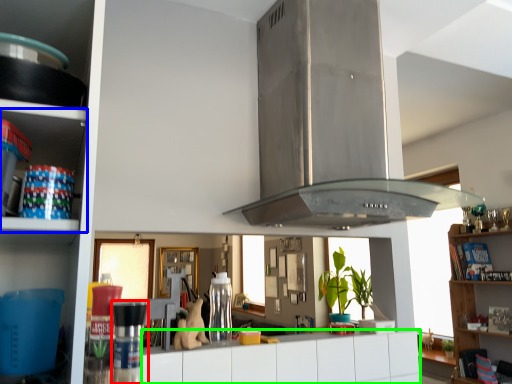
Question: Estimate the real-world distances between objects in this image. Which object is closer to appliance (highlighted by a red box), shelf (highlighted by a blue box) or drawer (highlighted by a green box)?

Choices:
 (A) shelf
 (B) drawer

Answer: (A)